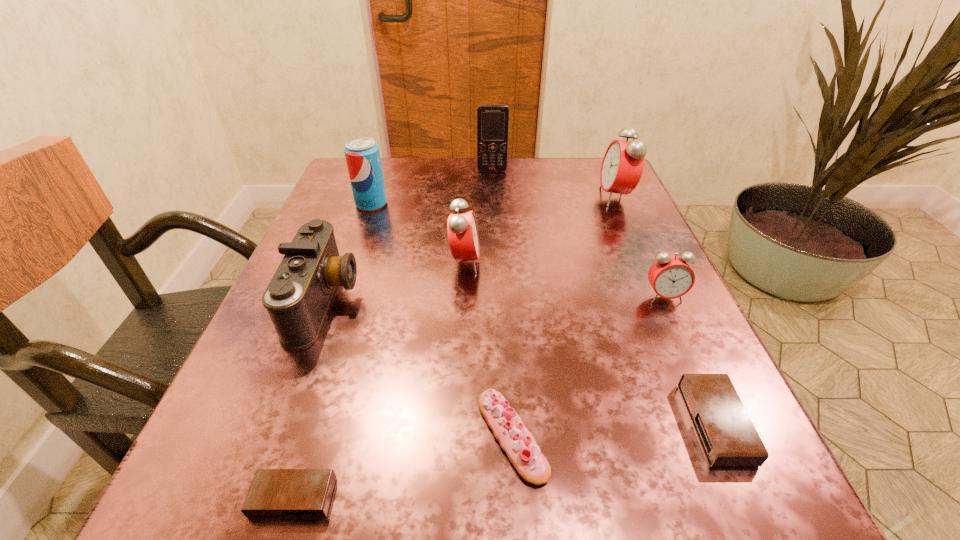
I want to click on cellular telephone, so click(x=492, y=119).

You are a GUI agent. You are given a task and a screenshot of the screen. Output one action in this format:
    pyautogui.click(x=<x>, y=<y>)
    Task: Click on the orange cellular telephone
    
    Given the screenshot: What is the action you would take?
    pyautogui.click(x=492, y=119)

The image size is (960, 540). I want to click on the biggest red alarm clock, so click(623, 163).

Where is `the farthest alarm clock`? This screenshot has height=540, width=960. the farthest alarm clock is located at coordinates (623, 163).

You are a GUI agent. You are given a task and a screenshot of the screen. Output one action in this format:
    pyautogui.click(x=<x>, y=<y>)
    Task: Click on the soda can
    The width and height of the screenshot is (960, 540).
    Given the screenshot: What is the action you would take?
    pyautogui.click(x=362, y=155)

Locate an element on the screen. This screenshot has height=540, width=960. the second nearest red alarm clock is located at coordinates (462, 231).

Find the location of `the leftmost red alarm clock`. the leftmost red alarm clock is located at coordinates (462, 231).

This screenshot has height=540, width=960. In order to click on camera in this screenshot , I will do [298, 297].

You are a GUI agent. You are given a task and a screenshot of the screen. Output one action in this format:
    pyautogui.click(x=<x>, y=<y>)
    Task: Click on the sixth tallest object
    The image size is (960, 540).
    Given the screenshot: What is the action you would take?
    pyautogui.click(x=671, y=277)

This screenshot has width=960, height=540. Identify the location of the third tallest alarm clock. (671, 277).